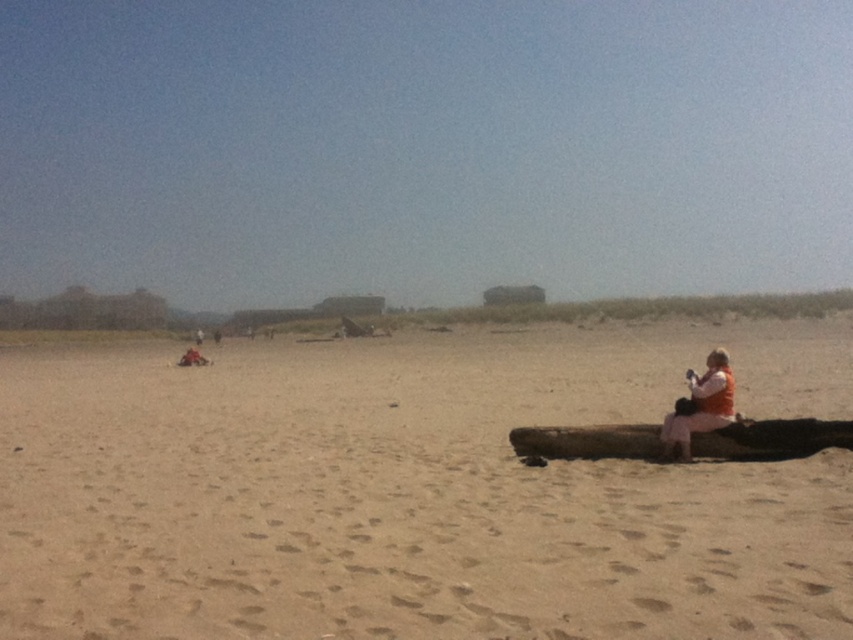
Question: Is smooth sand at lower right above brown wood log at lower right?

Choices:
 (A) yes
 (B) no

Answer: (A)

Question: Which point is farther from the camera taking this photo?

Choices:
 (A) (267, 616)
 (B) (572, 451)

Answer: (B)

Question: Can you confirm if smooth sand at lower right is positioned to the left of brown wood log at lower right?

Choices:
 (A) yes
 (B) no

Answer: (A)

Question: Is smooth sand at lower right further to camera compared to brown wood log at lower right?

Choices:
 (A) yes
 (B) no

Answer: (B)